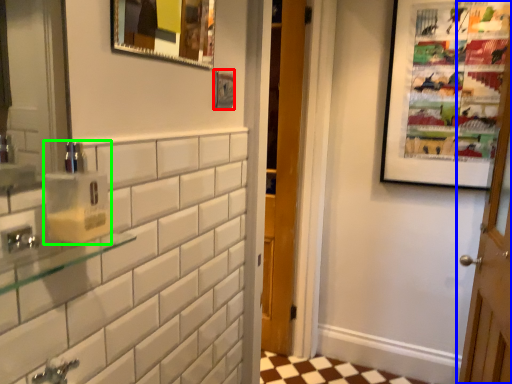
Question: Based on their relative distances, which object is farther from picture frame (highlighted by a red box)? Choose from door (highlighted by a blue box) and soap dispenser (highlighted by a green box).

Choices:
 (A) door
 (B) soap dispenser

Answer: (A)